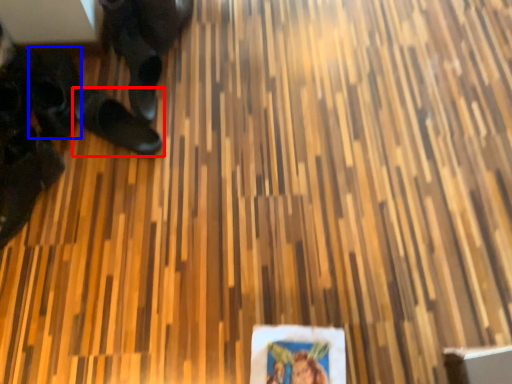
Question: Which object is further to the camera taking this photo, footwear (highlighted by a red box) or footwear (highlighted by a blue box)?

Choices:
 (A) footwear
 (B) footwear

Answer: (B)